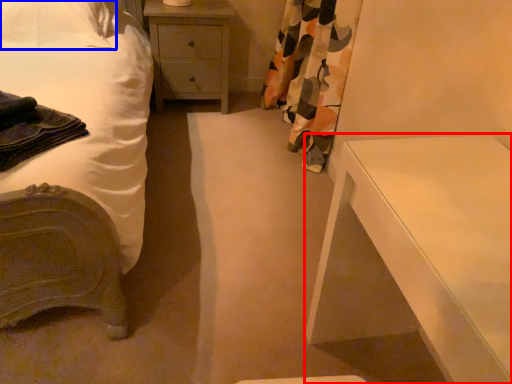
Question: Among these objects, which one is farthest to the camera, nightstand (highlighted by a red box) or pillow (highlighted by a blue box)?

Choices:
 (A) nightstand
 (B) pillow

Answer: (B)